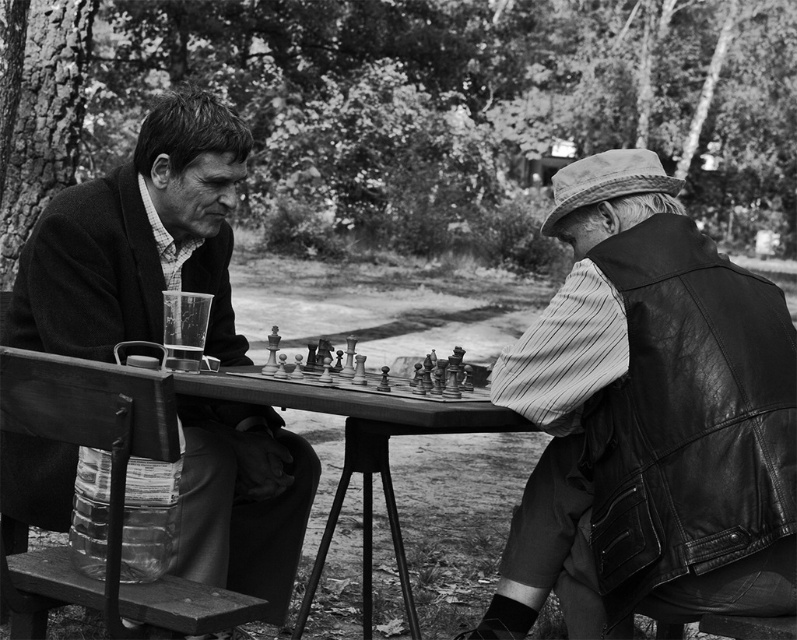
Based on the photo, you are a photographer trying to capture a closeup of both the leather vest at right and the matte black jacket at left in the scene. Since you want both to be in focus, you need to know which one is closer to the camera. Can you determine which object is nearer?

The leather vest at right has a lesser height compared to matte black jacket at left, so the leather vest at right is closer to the camera.

You are a photographer standing 20 inches away from the wooden picnic table at center. You want to take a photo of the matte black jacket at left without moving the table. Can you move closer to the jacket to ensure it fills the frame without exceeding the 20 inches distance limit?

The matte black jacket at left and wooden picnic table at center are 17.46 inches apart from each other. Since you are already 20 inches away from the table, moving 17.46 inches closer would place you 2.54 inches away from the jacket, which is within the 20 inches limit. Yes, you can move closer to the jacket.